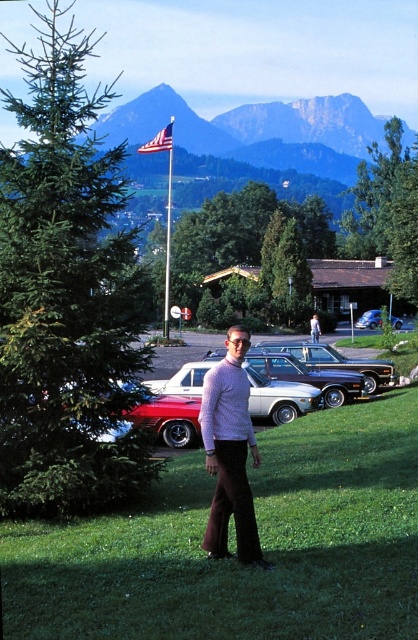
Question: Is green leafy tree at left below green leafy tree at center?

Choices:
 (A) no
 (B) yes

Answer: (A)

Question: Considering the relative positions of green leafy tree at left and blue fabric flag at upper center in the image provided, where is green leafy tree at left located with respect to blue fabric flag at upper center?

Choices:
 (A) left
 (B) right

Answer: (A)

Question: Which object is closer to the camera taking this photo?

Choices:
 (A) blue fabric flag at upper center
 (B) green leafy tree at center

Answer: (A)

Question: Which of the following is the closest to the observer?

Choices:
 (A) (412, 580)
 (B) (349, 173)
 (C) (162, 132)

Answer: (A)

Question: Which object appears closest to the camera in this image?

Choices:
 (A) metallic blue car at center
 (B) metallic silver sedan at center

Answer: (B)

Question: Is green leafy tree at left below metallic blue car at center?

Choices:
 (A) no
 (B) yes

Answer: (A)